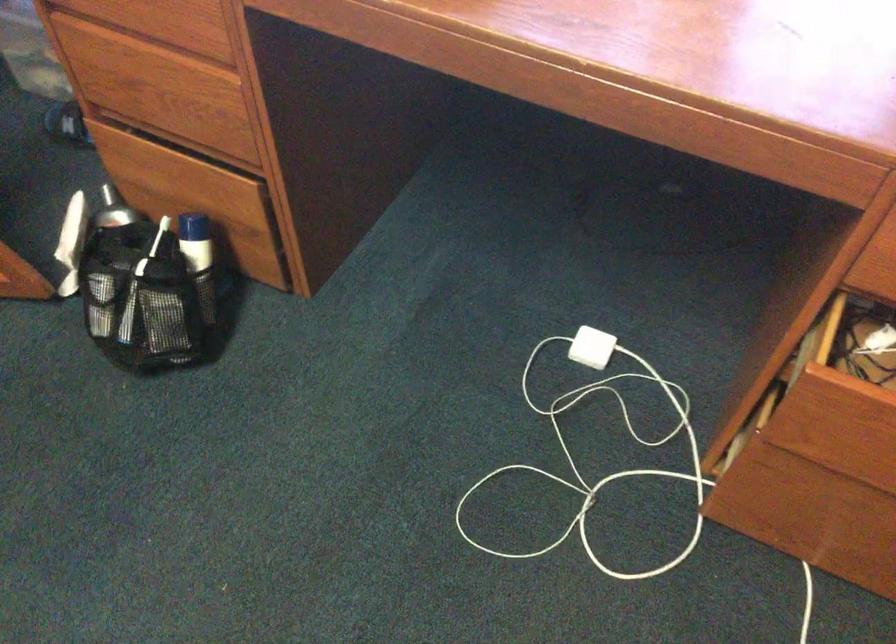
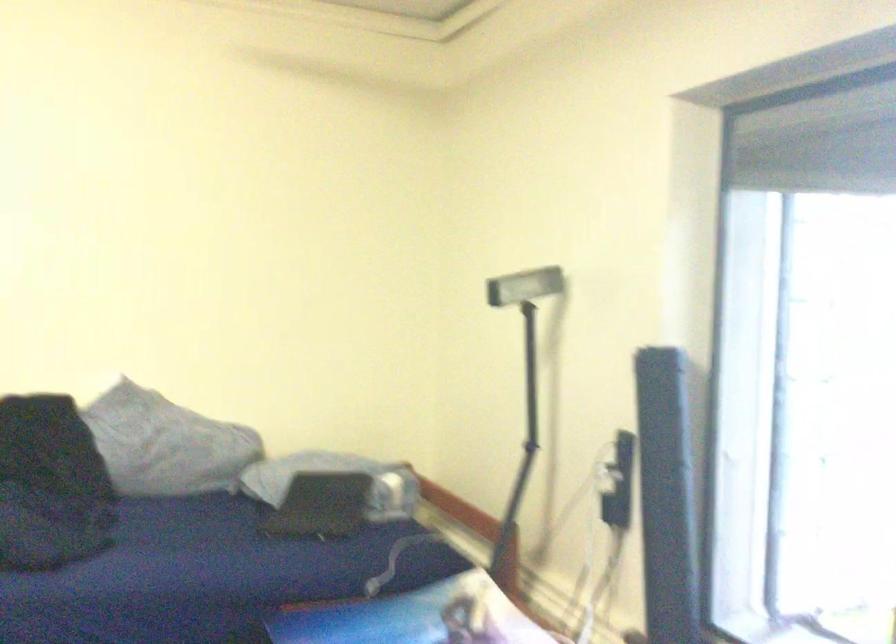
Based on the continuous images, in which direction is the camera rotating?

The rotation direction of the camera is left-up.